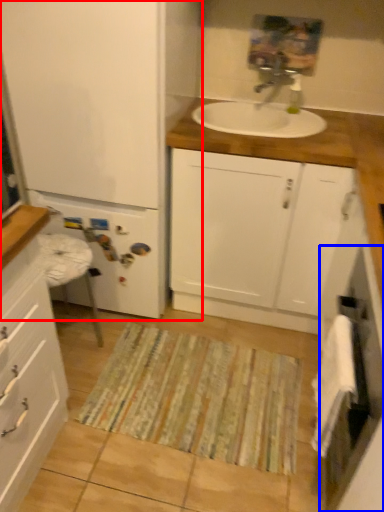
Question: Among these objects, which one is nearest to the camera, bathroom cabinet (highlighted by a red box) or screen door (highlighted by a blue box)?

Choices:
 (A) bathroom cabinet
 (B) screen door

Answer: (B)